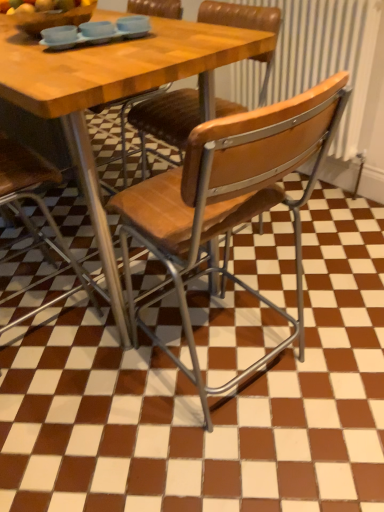
Question: Does wooden seat at center, positioned as the 1th chair in left-to-right order, have a larger size compared to wooden seat at center, positioned as the second chair in right-to-left order?

Choices:
 (A) no
 (B) yes

Answer: (A)

Question: Is wooden seat at center, marked as the 3th chair in a right-to-left arrangement, thinner than wooden seat at center, which is the 2th chair in left-to-right order?

Choices:
 (A) no
 (B) yes

Answer: (B)

Question: Does wooden seat at center, marked as the 3th chair in a right-to-left arrangement, have a smaller size compared to wooden seat at center, which is the 2th chair in left-to-right order?

Choices:
 (A) yes
 (B) no

Answer: (A)

Question: Is wooden seat at center, positioned as the 1th chair in left-to-right order, next to wooden seat at center, positioned as the second chair in right-to-left order, and touching it?

Choices:
 (A) no
 (B) yes

Answer: (A)

Question: From the image's perspective, is wooden seat at center, marked as the 3th chair in a right-to-left arrangement, located above wooden seat at center, positioned as the second chair in right-to-left order?

Choices:
 (A) yes
 (B) no

Answer: (B)

Question: Visually, is wooden chair at center positioned to the left or to the right of wooden bowl at upper left?

Choices:
 (A) left
 (B) right

Answer: (B)

Question: Is wooden chair at center inside or outside of wooden bowl at upper left?

Choices:
 (A) outside
 (B) inside

Answer: (A)

Question: From their relative heights in the image, would you say wooden chair at center is taller or shorter than wooden bowl at upper left?

Choices:
 (A) short
 (B) tall

Answer: (B)

Question: Considering their positions, is wooden chair at center located in front of or behind wooden bowl at upper left?

Choices:
 (A) front
 (B) behind

Answer: (A)

Question: From their relative heights in the image, would you say wooden seat at center, the third chair when ordered from left to right, is taller or shorter than wooden seat at center, positioned as the 1th chair in left-to-right order?

Choices:
 (A) tall
 (B) short

Answer: (A)

Question: From the image's perspective, is wooden seat at center, positioned as the first chair in right-to-left order, located above or below wooden seat at center, marked as the 3th chair in a right-to-left arrangement?

Choices:
 (A) above
 (B) below

Answer: (B)

Question: Is wooden seat at center, the third chair when ordered from left to right, bigger or smaller than wooden seat at center, positioned as the 1th chair in left-to-right order?

Choices:
 (A) small
 (B) big

Answer: (B)

Question: From a real-world perspective, is wooden seat at center, positioned as the first chair in right-to-left order, physically located above or below wooden seat at center, positioned as the 1th chair in left-to-right order?

Choices:
 (A) below
 (B) above

Answer: (A)

Question: From the image's perspective, is wooden bowl at upper left above or below wooden seat at center, the third chair when ordered from left to right?

Choices:
 (A) above
 (B) below

Answer: (A)

Question: Choose the correct answer: Is wooden bowl at upper left inside wooden seat at center, positioned as the first chair in right-to-left order, or outside it?

Choices:
 (A) outside
 (B) inside

Answer: (A)